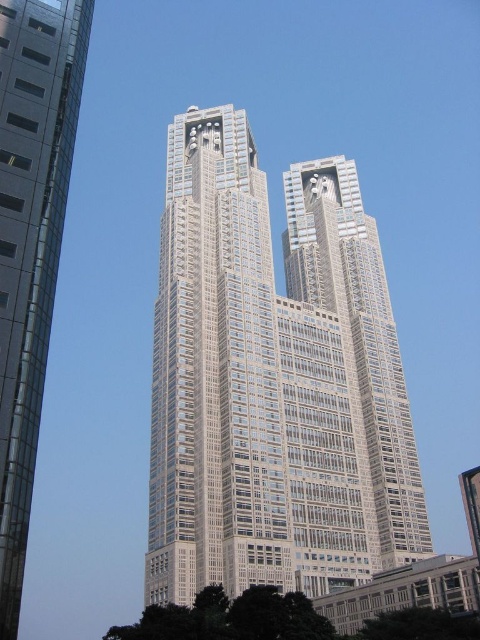
Who is taller, white glass building at center or silver glass skyscraper at center?

white glass building at center

Can you confirm if white glass building at center is positioned to the left of silver glass skyscraper at center?

In fact, white glass building at center is to the right of silver glass skyscraper at center.

Is point (316, 452) closer to viewer compared to point (21, 582)?

No.

Where is `white glass building at center`? The height and width of the screenshot is (640, 480). white glass building at center is located at coordinates [273, 380].